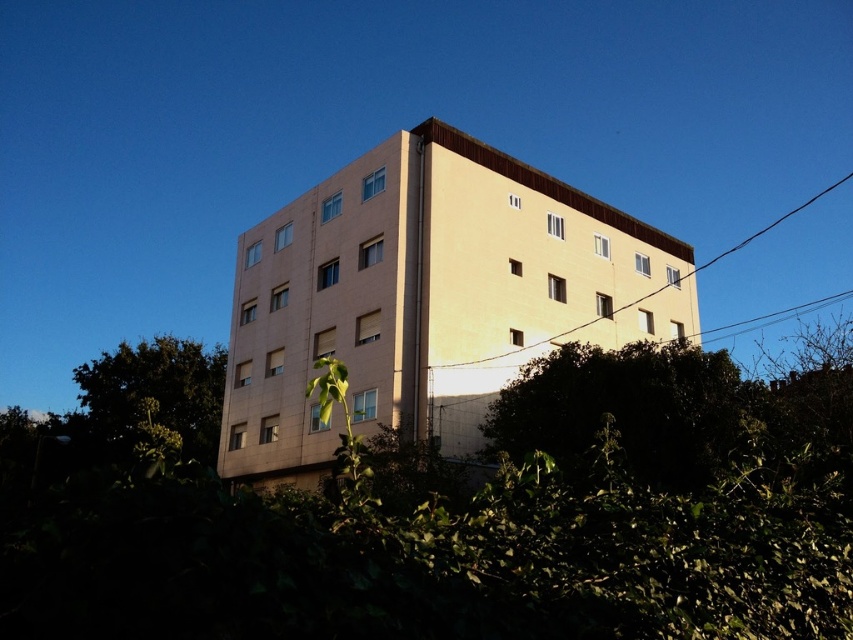
You are standing in front of the building and want to take a photo of the tan smooth building at center without the green leafy hedge at lower center blocking the view. What should you do?

Move backward away from the green leafy hedge at lower center to position yourself further from it, allowing the tan smooth building at center to become visible without obstruction from the hedge.

You are standing in front of the residential building and see a small plant with green leaves in the center of the frame. There is a point marked at coordinates (456, 518). What is located at that point?

The point at (456, 518) is occupied by the green leafy hedge at lower center.

You are a gardener who wants to trim the green leafy hedge at lower center and the tan smooth building at center. Which object is shorter and requires less ladder height for trimming?

The green leafy hedge at lower center is shorter than the tan smooth building at center, so it requires less ladder height for trimming.